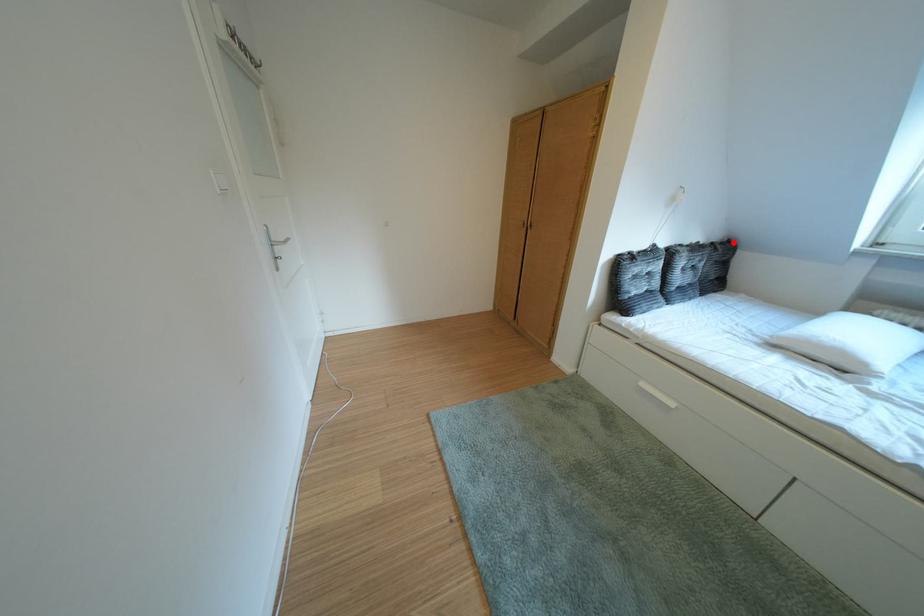
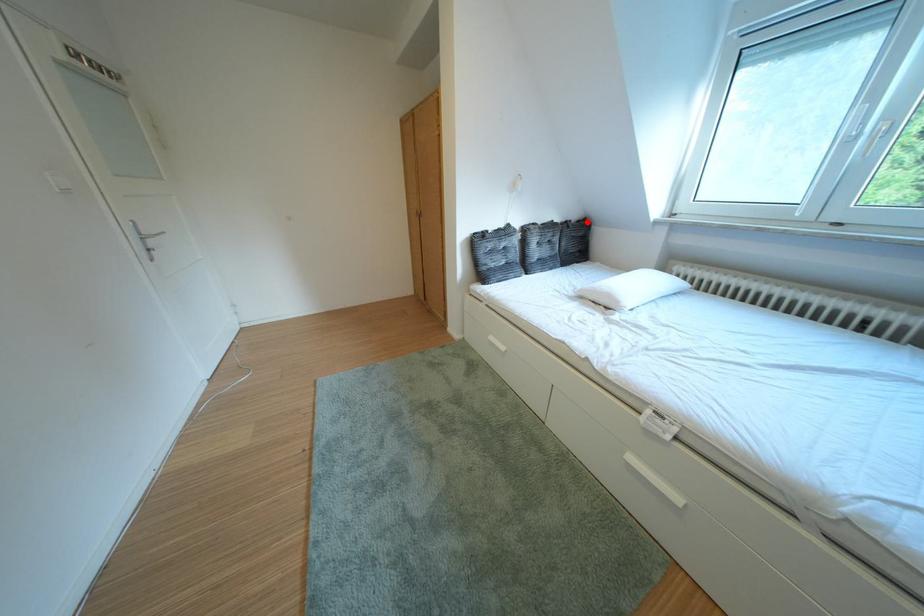
I am providing you with two images of the same scene from different viewpoints. A red point is marked on the first image and another point is marked on the second image. Does the point marked in image1 correspond to the same location as the one in image2?

Yes